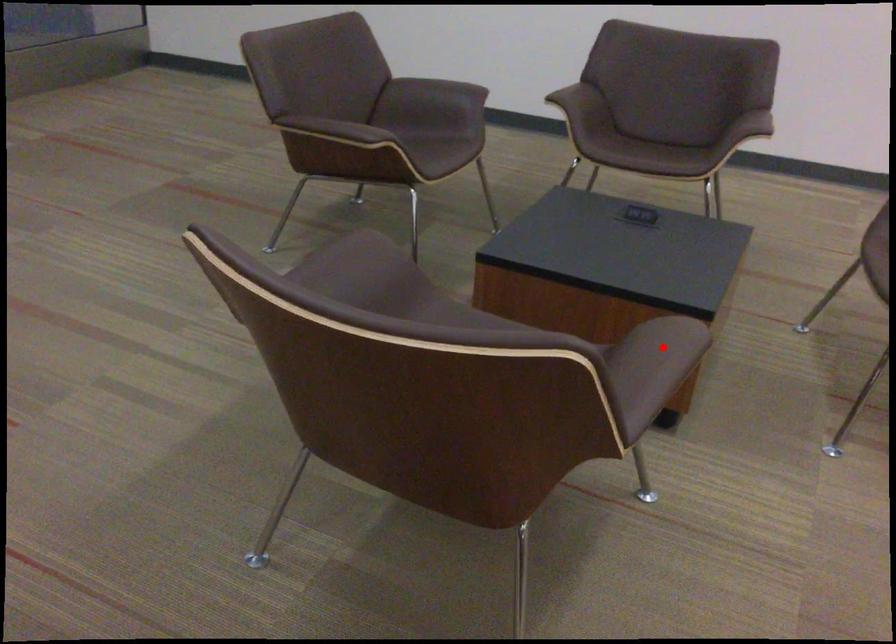
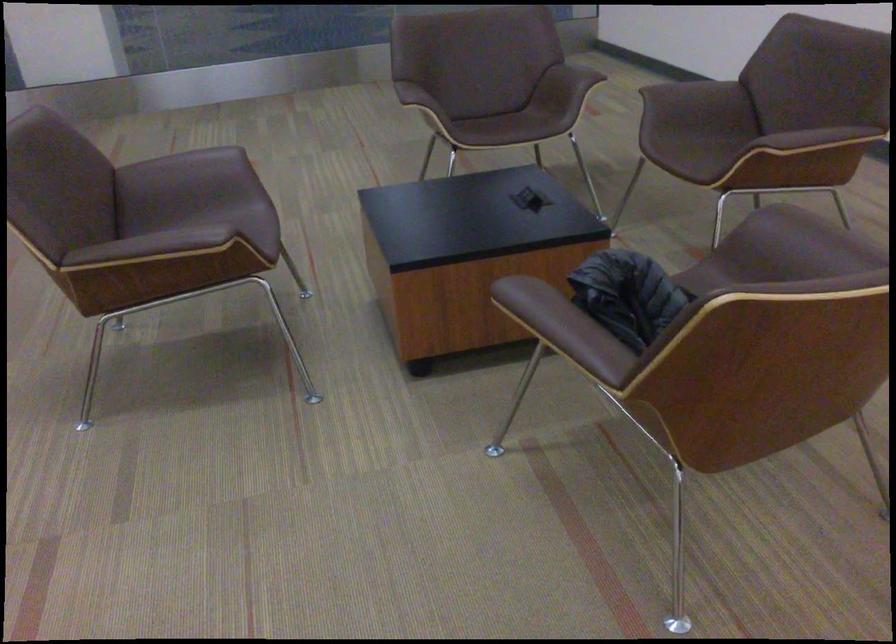
In the second image, find the point that corresponds to the highlighted location in the first image.

(174, 242)